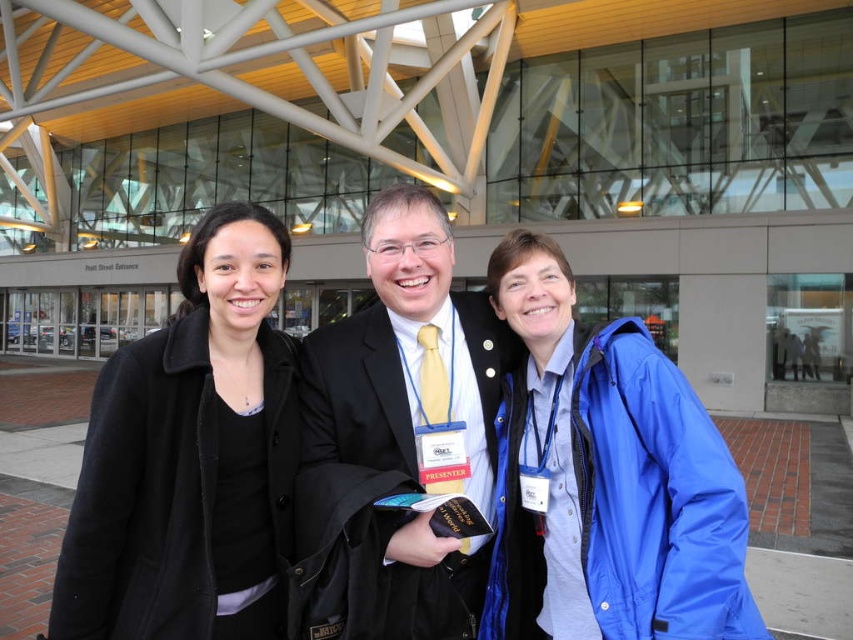
You are standing at the Pearl Street Entrance of the convention center and see two points marked on the ground. The first point is at coordinates point (641,467) and the second point is at point (453,422). Which point is closer to you?

Point (641,467) is in front of point (453,422), so it is closer to you.

You are a photographer at the Pearl Street Entrance. You need to adjust your camera to focus on both the blue matte jacket at right and the matte black suit at center. Which object is positioned lower in the frame?

The blue matte jacket at right is located below the matte black suit at center, so it is positioned lower in the frame.

You are a photographer trying to capture a group photo of the black matte coat at left and the blue matte jacket at right. Since you want both subjects to be centered in the frame, which direction should you move the camera to align them properly?

The black matte coat at left is positioned on the left side of blue matte jacket at right. To center both subjects in the frame, you should move the camera slightly to the left so that the black matte coat at left and the blue matte jacket at right are aligned centrally.